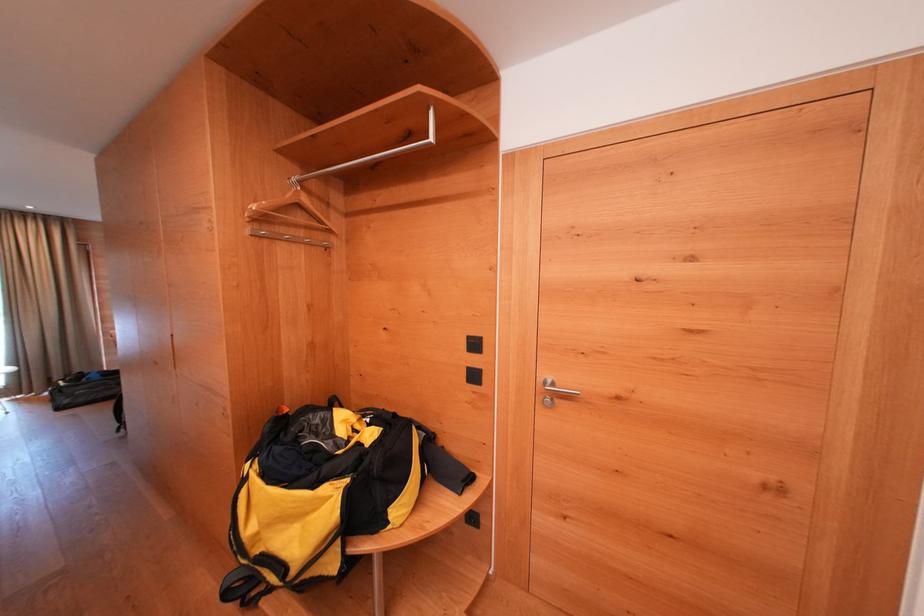
This screenshot has height=616, width=924. Describe the element at coordinates (244, 586) in the screenshot. I see `the black bag strap` at that location.